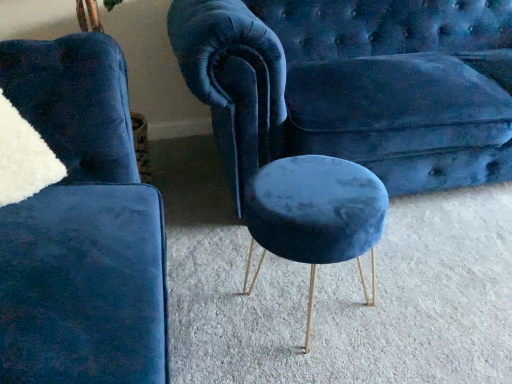
Locate an element on the screen. This screenshot has height=384, width=512. unoccupied region to the right of velvet blue stool at center is located at coordinates (418, 291).